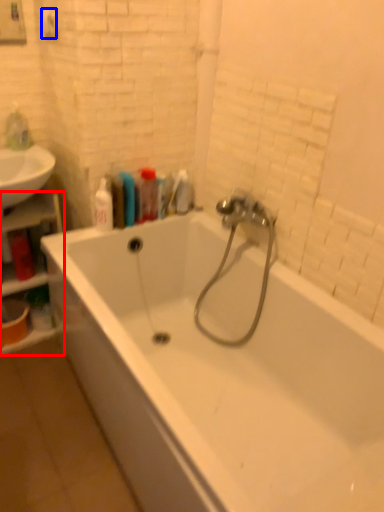
Question: Which object appears farthest to the camera in this image, shelf (highlighted by a red box) or towel bar (highlighted by a blue box)?

Choices:
 (A) shelf
 (B) towel bar

Answer: (A)